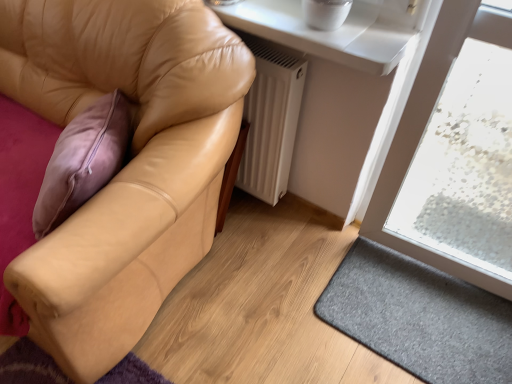
Find the location of a particular element. This screenshot has width=512, height=384. white matte radiator at lower center is located at coordinates (271, 118).

Where is `white glossy window sill at upper center`? white glossy window sill at upper center is located at coordinates (331, 31).

The image size is (512, 384). In order to click on tan leather couch at left in this screenshot , I will do `click(127, 164)`.

The width and height of the screenshot is (512, 384). What are the coordinates of `gray felt doormat at lower right` in the screenshot? It's located at (419, 317).

Between white matte radiator at lower center and white glossy window sill at upper center, which one has smaller width?

white matte radiator at lower center.

Is white matte radiator at lower center at the right side of white glossy window sill at upper center?

No, white matte radiator at lower center is not to the right of white glossy window sill at upper center.

Can you see white matte radiator at lower center touching white glossy window sill at upper center?

white matte radiator at lower center and white glossy window sill at upper center are clearly separated.

Considering the positions of points (249, 104) and (397, 48), is point (249, 104) farther from camera compared to point (397, 48)?

Yes.

Is white matte radiator at lower center with tan leather couch at left?

No, white matte radiator at lower center is not with tan leather couch at left.

From the picture: From a real-world perspective, relative to tan leather couch at left, is white matte radiator at lower center vertically above or below?

In terms of real-world spatial position, white matte radiator at lower center is below tan leather couch at left.

Is white matte radiator at lower center aimed at tan leather couch at left?

Yes, white matte radiator at lower center is oriented towards tan leather couch at left.

Looking at this image, what's the angular difference between white matte radiator at lower center and tan leather couch at left's facing directions?

2.93 degrees.

Considering the sizes of white glossy window sill at upper center and gray felt doormat at lower right in the image, is white glossy window sill at upper center wider or thinner than gray felt doormat at lower right?

Clearly, white glossy window sill at upper center has less width compared to gray felt doormat at lower right.

Can you confirm if white glossy window sill at upper center is bigger than gray felt doormat at lower right?

Correct, white glossy window sill at upper center is larger in size than gray felt doormat at lower right.

Is white glossy window sill at upper center oriented away from gray felt doormat at lower right?

white glossy window sill at upper center does not have its back to gray felt doormat at lower right.

Considering the sizes of white glossy window sill at upper center and gray felt doormat at lower right in the image, is white glossy window sill at upper center taller or shorter than gray felt doormat at lower right?

Considering their sizes, white glossy window sill at upper center has more height than gray felt doormat at lower right.

Is there a large distance between white glossy window sill at upper center and white matte radiator at lower center?

white glossy window sill at upper center is actually quite close to white matte radiator at lower center.

How many degrees apart are the facing directions of white glossy window sill at upper center and white matte radiator at lower center?

The facing directions of white glossy window sill at upper center and white matte radiator at lower center are 1.56 degrees apart.

Locate an element on the screen. The height and width of the screenshot is (384, 512). window sill in front of the white matte radiator at lower center is located at coordinates (331, 31).

In the scene shown: From a real-world perspective, which is physically above, white glossy window sill at upper center or white matte radiator at lower center?

From a 3D spatial view, white glossy window sill at upper center is above.

Who is smaller, gray felt doormat at lower right or white glossy window sill at upper center?

gray felt doormat at lower right is smaller.

Based on the photo, which of these two, gray felt doormat at lower right or white glossy window sill at upper center, stands taller?

white glossy window sill at upper center is taller.

From the image's perspective, between white matte radiator at lower center and gray felt doormat at lower right, who is located below?

gray felt doormat at lower right, from the image's perspective.

Measure the distance between white matte radiator at lower center and gray felt doormat at lower right.

white matte radiator at lower center and gray felt doormat at lower right are 25.94 inches apart from each other.

Does point (262, 79) appear closer or farther from the camera than point (482, 332)?

Point (262, 79) is positioned closer to the camera compared to point (482, 332).

Which of these two, white matte radiator at lower center or gray felt doormat at lower right, stands shorter?

Standing shorter between the two is gray felt doormat at lower right.

Is tan leather couch at left to the right of white matte radiator at lower center from the viewer's perspective?

Incorrect, tan leather couch at left is not on the right side of white matte radiator at lower center.

Is tan leather couch at left bigger than white matte radiator at lower center?

Correct, tan leather couch at left is larger in size than white matte radiator at lower center.

Is tan leather couch at left positioned with its back to white matte radiator at lower center?

Yes.

Image resolution: width=512 pixels, height=384 pixels. I want to click on radiator located underneath the white glossy window sill at upper center (from a real-world perspective), so click(x=271, y=118).

Identify the location of studio couch to the left of white matte radiator at lower center. pos(127,164).

From the image, which object appears to be farther from white glossy window sill at upper center, tan leather couch at left or white matte radiator at lower center?

tan leather couch at left is positioned further to the anchor white glossy window sill at upper center.

Looking at this image, looking at the image, which one is located further to white matte radiator at lower center, tan leather couch at left or white glossy window sill at upper center?

Based on the image, tan leather couch at left appears to be further to white matte radiator at lower center.

Estimate the real-world distances between objects in this image. Which object is further from white matte radiator at lower center, gray felt doormat at lower right or white glossy window sill at upper center?

gray felt doormat at lower right is positioned further to the anchor white matte radiator at lower center.

Considering their positions, is white matte radiator at lower center positioned closer to tan leather couch at left than white glossy window sill at upper center?

white matte radiator at lower center lies closer to tan leather couch at left than the other object.

Estimate the real-world distances between objects in this image. Which object is further from gray felt doormat at lower right, white matte radiator at lower center or white glossy window sill at upper center?

white glossy window sill at upper center.

Considering their positions, is white glossy window sill at upper center positioned further to gray felt doormat at lower right than tan leather couch at left?

Among the two, white glossy window sill at upper center is located further to gray felt doormat at lower right.

Which object lies further to the anchor point gray felt doormat at lower right, white matte radiator at lower center or tan leather couch at left?

Among the two, tan leather couch at left is located further to gray felt doormat at lower right.

Based on their spatial positions, is white matte radiator at lower center or gray felt doormat at lower right closer to tan leather couch at left?

white matte radiator at lower center is positioned closer to the anchor tan leather couch at left.

The image size is (512, 384). Find the location of `radiator situated between tan leather couch at left and gray felt doormat at lower right from left to right`. radiator situated between tan leather couch at left and gray felt doormat at lower right from left to right is located at coordinates (271, 118).

Where is `radiator between white glossy window sill at upper center and gray felt doormat at lower right in the up-down direction`? radiator between white glossy window sill at upper center and gray felt doormat at lower right in the up-down direction is located at coordinates (271, 118).

Locate an element on the screen. The height and width of the screenshot is (384, 512). window sill between tan leather couch at left and gray felt doormat at lower right from left to right is located at coordinates (331, 31).

Where is `radiator located between tan leather couch at left and white glossy window sill at upper center in the left-right direction`? radiator located between tan leather couch at left and white glossy window sill at upper center in the left-right direction is located at coordinates (271, 118).